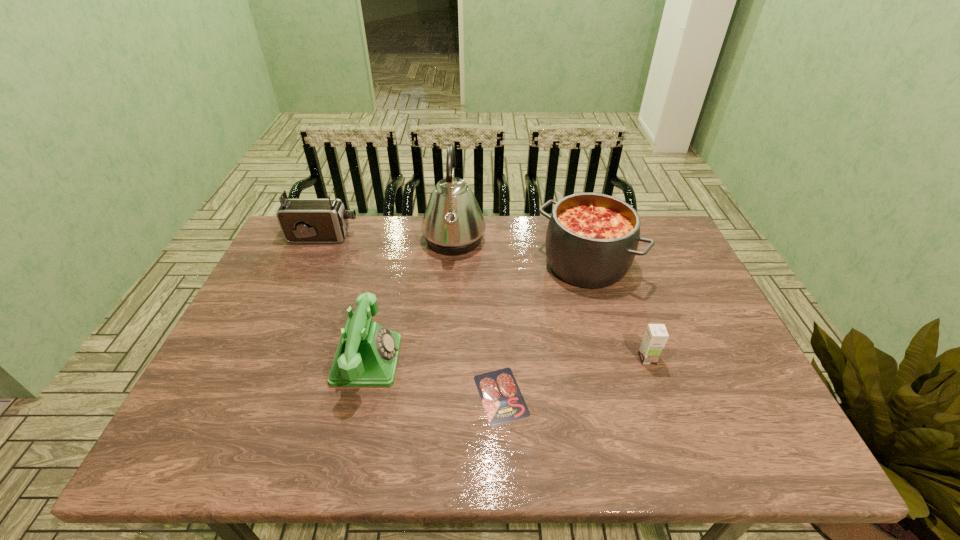
Identify the location of kettle. (453, 224).

The height and width of the screenshot is (540, 960). I want to click on casserole, so click(x=591, y=241).

Where is `the leftmost object`? This screenshot has width=960, height=540. the leftmost object is located at coordinates (301, 220).

Image resolution: width=960 pixels, height=540 pixels. I want to click on the fifth object from right to left, so [x=367, y=354].

I want to click on chocolate milk, so click(655, 338).

I want to click on the shortest object, so click(x=503, y=402).

Identify the location of free location located from the spout of the tallest object. (538, 241).

The height and width of the screenshot is (540, 960). What are the coordinates of `vacant point located on the left of the casserole` in the screenshot? It's located at (501, 264).

I want to click on vacant space positioned at the lens of the camcorder, so click(412, 237).

Locate an element on the screen. free space located 0.160m on the dial of the fifth object from right to left is located at coordinates (464, 360).